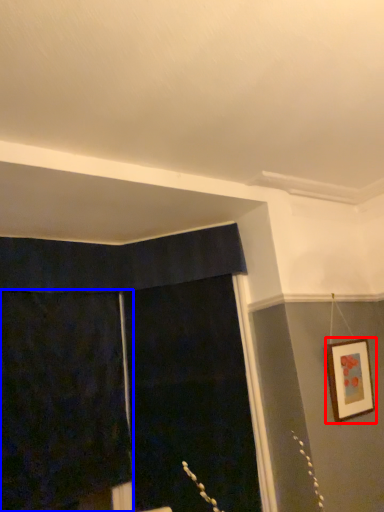
Question: Which of the following is the closest to the observer, picture frame (highlighted by a red box) or curtain (highlighted by a blue box)?

Choices:
 (A) picture frame
 (B) curtain

Answer: (B)